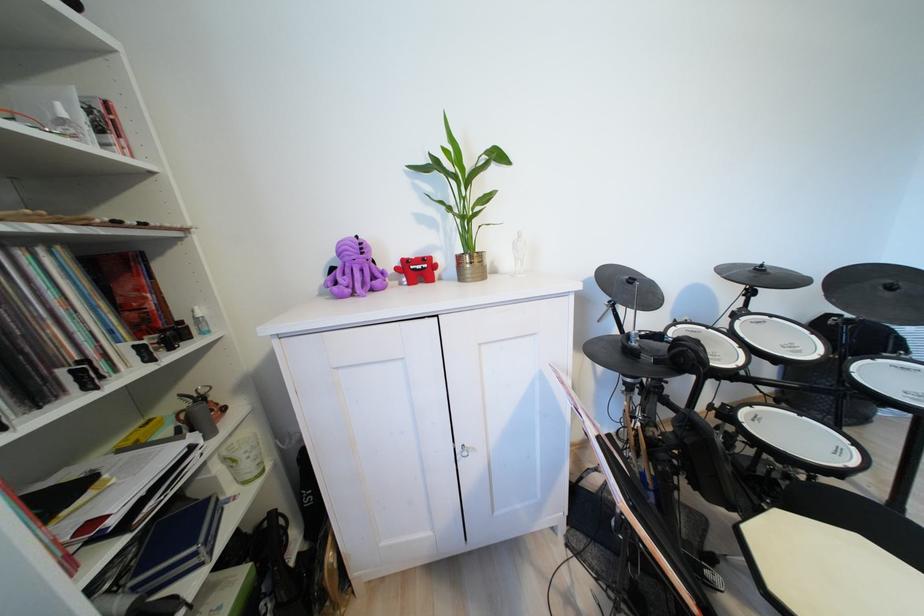
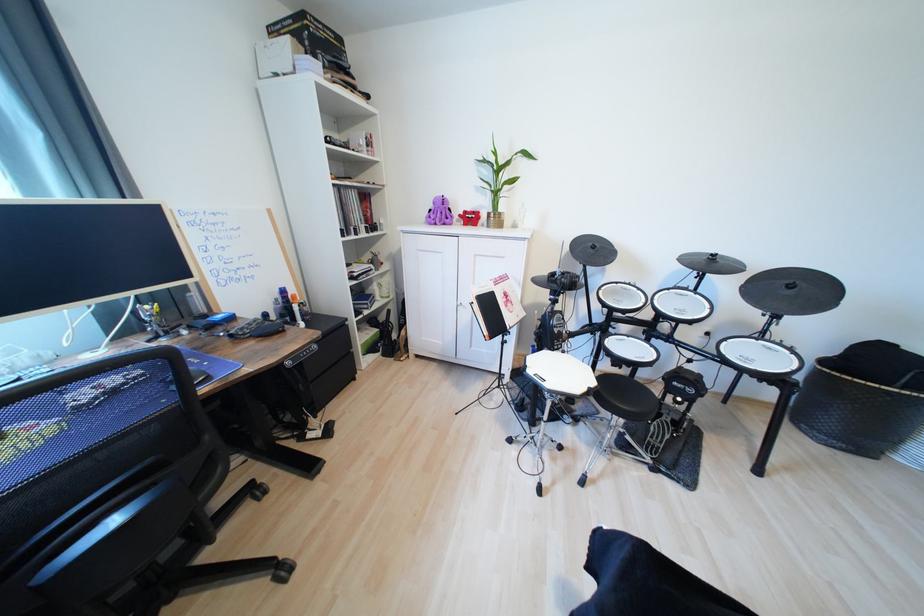
In the second image, find the point that corresponds to (x=411, y=262) in the first image.

(472, 214)